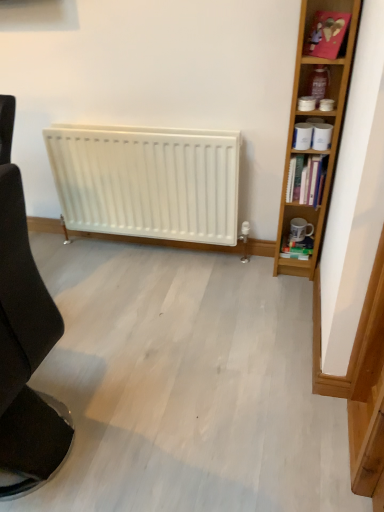
Question: Can you confirm if black fabric chair at left is wider than light brown wood bookcase at right?

Choices:
 (A) no
 (B) yes

Answer: (B)

Question: Can you confirm if black fabric chair at left is smaller than light brown wood bookcase at right?

Choices:
 (A) yes
 (B) no

Answer: (B)

Question: Is light brown wood bookcase at right located within black fabric chair at left?

Choices:
 (A) no
 (B) yes

Answer: (A)

Question: Is black fabric chair at left shorter than light brown wood bookcase at right?

Choices:
 (A) yes
 (B) no

Answer: (A)

Question: From the image's perspective, is black fabric chair at left under light brown wood bookcase at right?

Choices:
 (A) yes
 (B) no

Answer: (A)

Question: From the image's perspective, is pink cardboard at upper right located above or below black fabric chair at left?

Choices:
 (A) below
 (B) above

Answer: (B)

Question: Considering the positions of point (332, 28) and point (46, 432), is point (332, 28) closer or farther from the camera than point (46, 432)?

Choices:
 (A) closer
 (B) farther

Answer: (B)

Question: Looking at the image, does pink cardboard at upper right seem bigger or smaller compared to black fabric chair at left?

Choices:
 (A) small
 (B) big

Answer: (A)

Question: Considering the relative positions of pink cardboard at upper right and black fabric chair at left in the image provided, is pink cardboard at upper right to the left or to the right of black fabric chair at left?

Choices:
 (A) right
 (B) left

Answer: (A)

Question: Is point (289, 175) positioned closer to the camera than point (309, 79)?

Choices:
 (A) closer
 (B) farther

Answer: (B)

Question: Relative to matte plastic container at upper right, is hardcover books at right in front or behind?

Choices:
 (A) front
 (B) behind

Answer: (B)

Question: From their relative heights in the image, would you say hardcover books at right is taller or shorter than matte plastic container at upper right?

Choices:
 (A) tall
 (B) short

Answer: (A)

Question: Is hardcover books at right inside the boundaries of matte plastic container at upper right, or outside?

Choices:
 (A) inside
 (B) outside

Answer: (B)

Question: Considering their positions, is matte plastic container at upper right located in front of or behind light brown wood bookcase at right?

Choices:
 (A) front
 (B) behind

Answer: (B)

Question: Would you say matte plastic container at upper right is inside or outside light brown wood bookcase at right?

Choices:
 (A) inside
 (B) outside

Answer: (A)